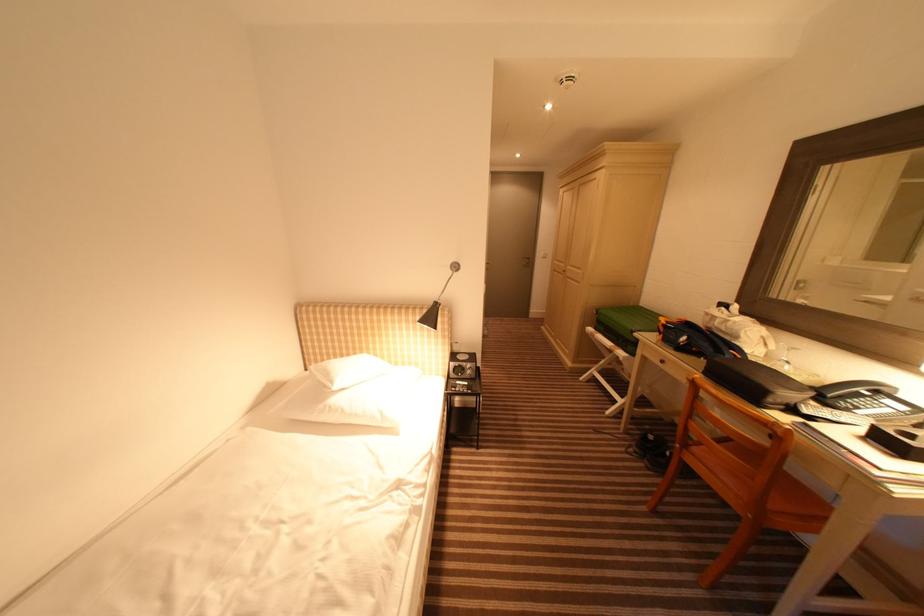
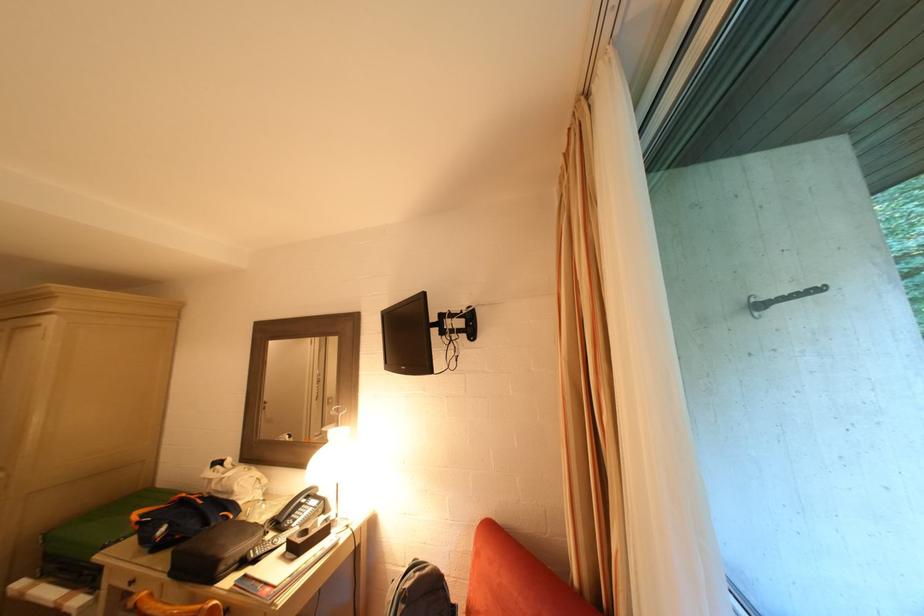
Question: The first image is from the beginning of the video and the second image is from the end. How did the camera likely rotate when shooting the video?

Choices:
 (A) Left
 (B) Right
 (C) Up
 (D) Down

Answer: (B)